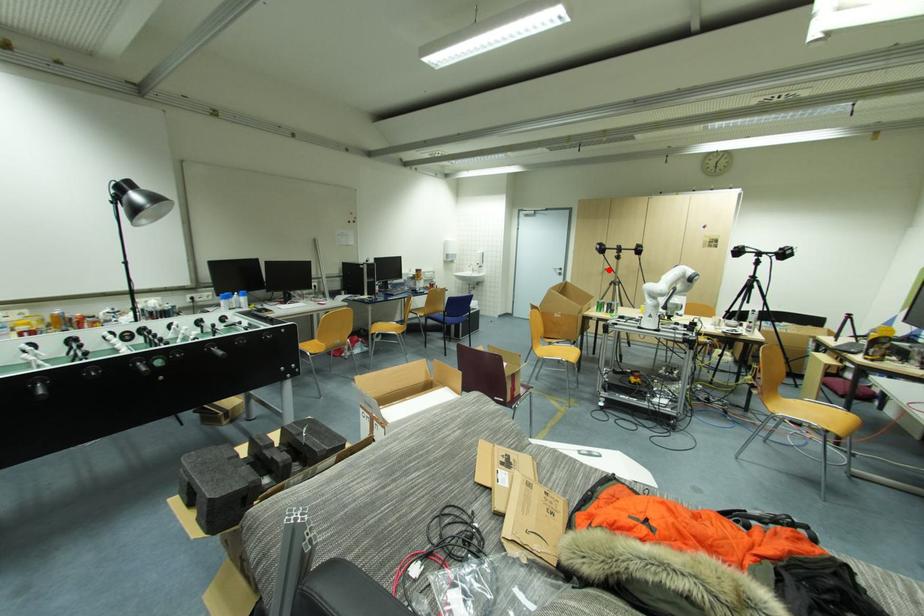
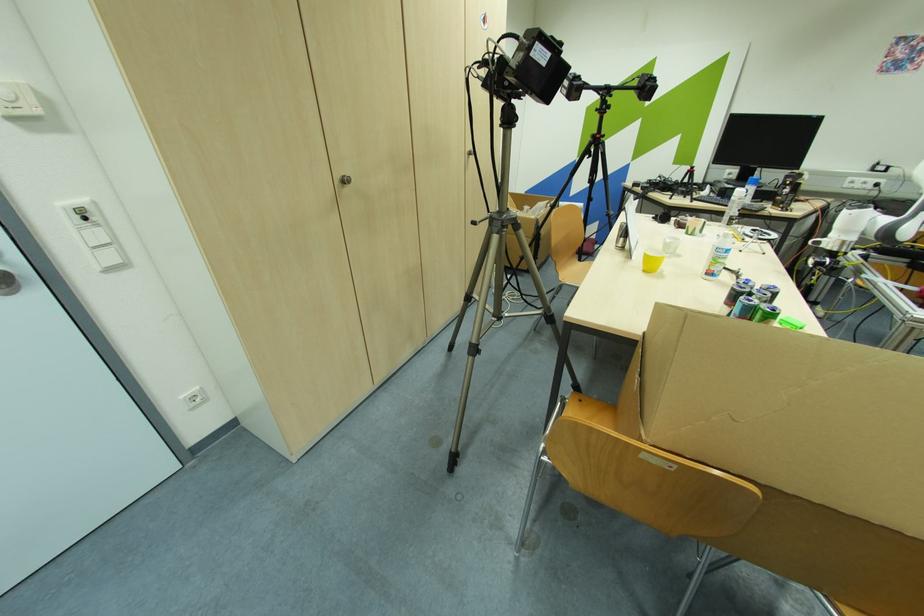
Question: I am providing you with two images of the same scene from different viewpoints. Given a red point in image1, look at the same physical point in image2. Is it:

Choices:
 (A) Closer to the viewpoint
 (B) Farther from the viewpoint

Answer: (B)